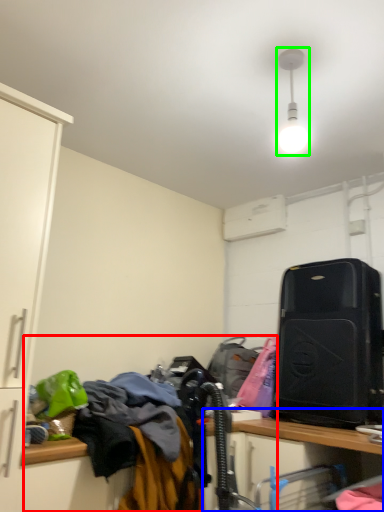
Question: Which object is the closest to the laundry (highlighted by a red box)? Choose among these: computer desk (highlighted by a blue box) or light fixture (highlighted by a green box).

Choices:
 (A) computer desk
 (B) light fixture

Answer: (A)